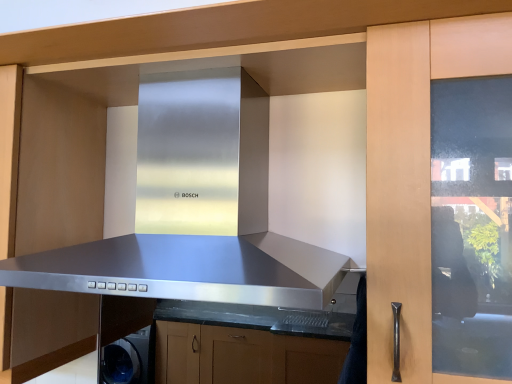
Identify the location of stainless steel vent at center. 189,203.

Image resolution: width=512 pixels, height=384 pixels. Describe the element at coordinates (189, 203) in the screenshot. I see `stainless steel vent at center` at that location.

At what (x,y) coordinates should I click in order to perform the action: click on stainless steel vent at center. Please return your answer as a coordinate pair (x, y). Looking at the image, I should click on (189, 203).